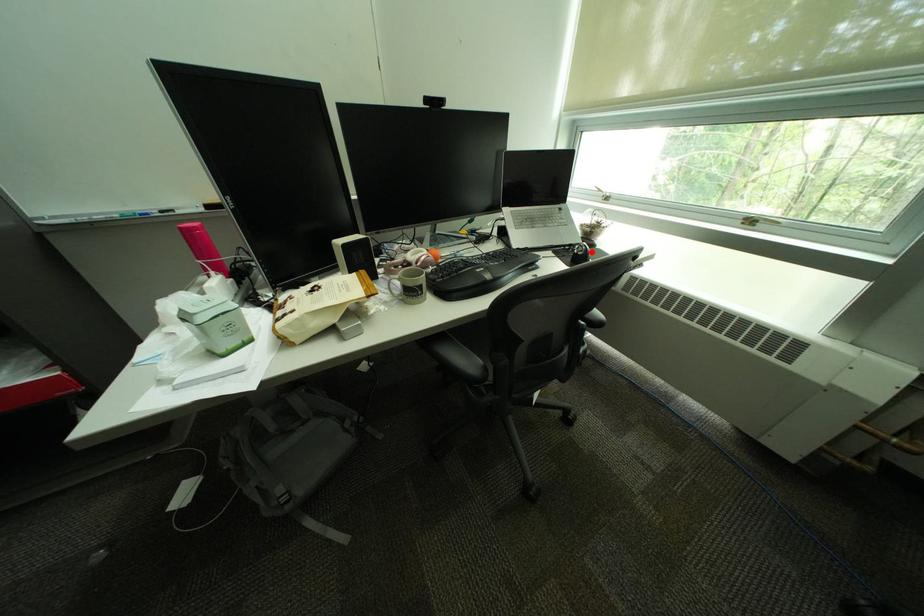
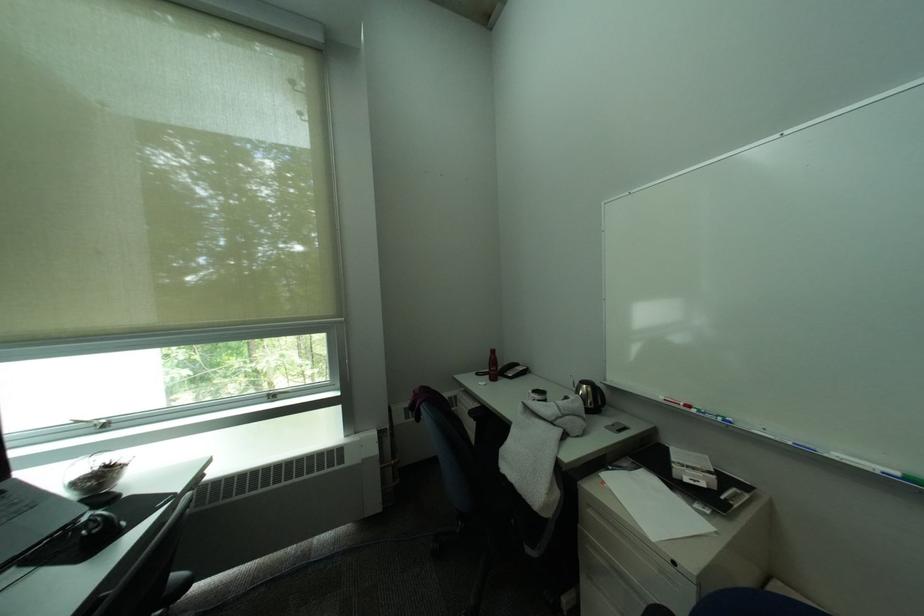
Question: A red point is marked in image1. In image2, is the corresponding 3D point closer to the camera or farther? Reply with the corresponding letter.

Choices:
 (A) The corresponding 3D point is closer.
 (B) The corresponding 3D point is farther.

Answer: (A)